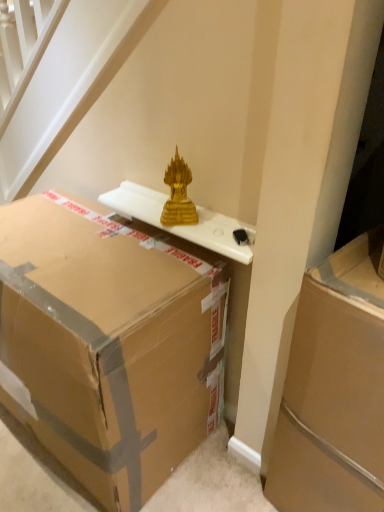
Question: Is white glossy table at upper center turned away from gold glass sculpture at upper center?

Choices:
 (A) no
 (B) yes

Answer: (B)

Question: Considering the relative sizes of white glossy table at upper center and gold glass sculpture at upper center in the image provided, is white glossy table at upper center bigger than gold glass sculpture at upper center?

Choices:
 (A) no
 (B) yes

Answer: (B)

Question: Is white glossy table at upper center behind gold glass sculpture at upper center?

Choices:
 (A) yes
 (B) no

Answer: (B)

Question: Is gold glass sculpture at upper center completely or partially inside white glossy table at upper center?

Choices:
 (A) yes
 (B) no

Answer: (B)

Question: From a real-world perspective, is white glossy table at upper center on gold glass sculpture at upper center?

Choices:
 (A) no
 (B) yes

Answer: (A)

Question: From a real-world perspective, relative to brown cardboard box at center, which appears as the second box when viewed from the right, is brown cardboard box at right, which is the second box from left to right, vertically above or below?

Choices:
 (A) above
 (B) below

Answer: (A)

Question: Is point (382, 414) closer or farther from the camera than point (120, 311)?

Choices:
 (A) farther
 (B) closer

Answer: (B)

Question: From the image's perspective, is brown cardboard box at right, which is the second box from left to right, above or below brown cardboard box at center, which appears as the second box when viewed from the right?

Choices:
 (A) above
 (B) below

Answer: (B)

Question: Do you think brown cardboard box at right, arranged as the 1th box when viewed from the right, is within brown cardboard box at center, which appears as the second box when viewed from the right, or outside of it?

Choices:
 (A) outside
 (B) inside

Answer: (A)

Question: Is brown cardboard box at center, positioned as the 1th box in left-to-right order, taller or shorter than white glossy table at upper center?

Choices:
 (A) tall
 (B) short

Answer: (A)

Question: Is brown cardboard box at center, which appears as the second box when viewed from the right, inside the boundaries of white glossy table at upper center, or outside?

Choices:
 (A) outside
 (B) inside

Answer: (A)

Question: Visually, is brown cardboard box at center, which appears as the second box when viewed from the right, positioned to the left or to the right of white glossy table at upper center?

Choices:
 (A) left
 (B) right

Answer: (A)

Question: From the image's perspective, relative to white glossy table at upper center, is brown cardboard box at center, positioned as the 1th box in left-to-right order, above or below?

Choices:
 (A) above
 (B) below

Answer: (B)

Question: From a real-world perspective, is brown cardboard box at center, positioned as the 1th box in left-to-right order, above or below gold glass sculpture at upper center?

Choices:
 (A) above
 (B) below

Answer: (B)

Question: Is point (200, 422) closer or farther from the camera than point (173, 197)?

Choices:
 (A) farther
 (B) closer

Answer: (A)